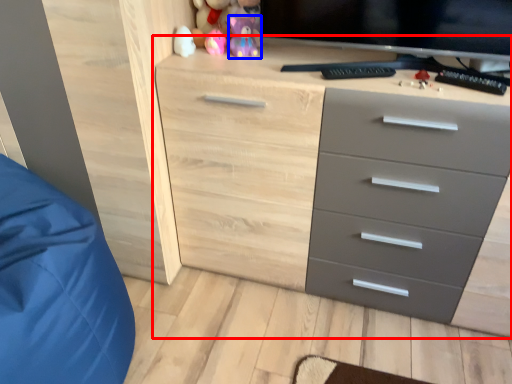
Question: Which of the following is the closest to the observer, chest of drawers (highlighted by a red box) or toy (highlighted by a blue box)?

Choices:
 (A) chest of drawers
 (B) toy

Answer: (A)